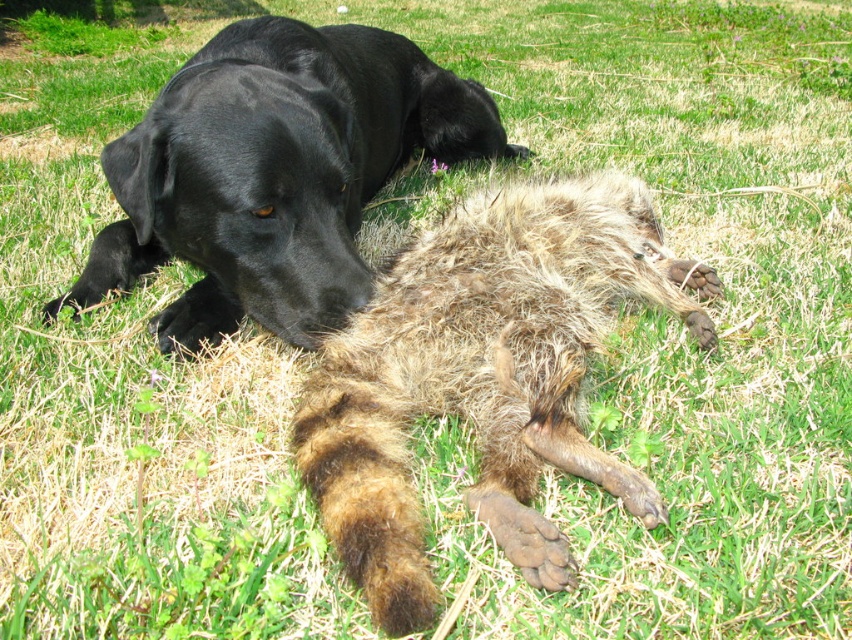
Question: Observing the image, what is the correct spatial positioning of fuzzy brown fur at center in reference to black matte dog at upper left?

Choices:
 (A) right
 (B) left

Answer: (A)

Question: Is fuzzy brown fur at center to the left of black matte dog at upper left from the viewer's perspective?

Choices:
 (A) yes
 (B) no

Answer: (B)

Question: Can you confirm if fuzzy brown fur at center is thinner than black matte dog at upper left?

Choices:
 (A) no
 (B) yes

Answer: (B)

Question: Which object appears closest to the camera in this image?

Choices:
 (A) fuzzy brown fur at center
 (B) black matte dog at upper left

Answer: (A)